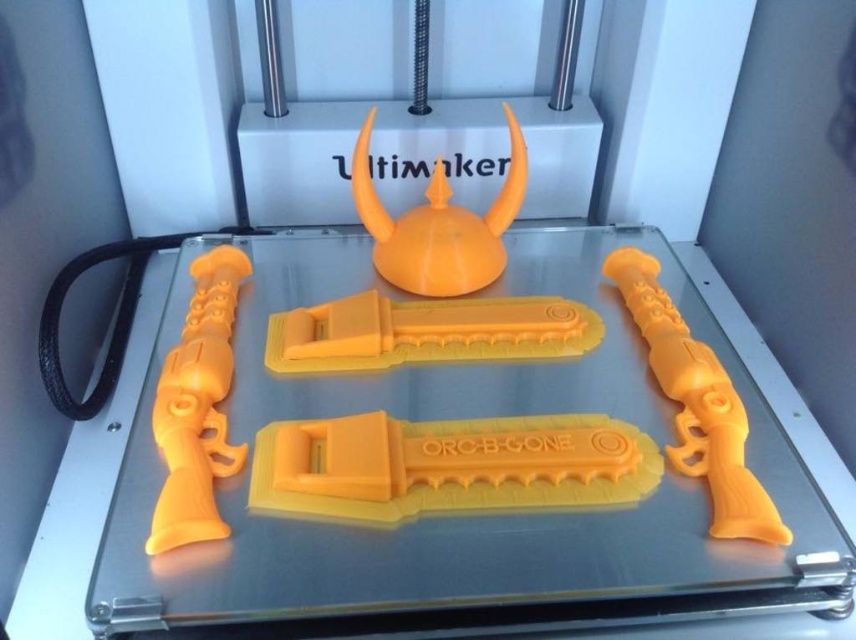
Who is more forward, (758, 630) or (742, 515)?

Positioned in front is point (742, 515).

Which is more to the right, translucent yellow plastic glass table at center or yellow matte plastic revolver at right?

Positioned to the right is yellow matte plastic revolver at right.

You are a GUI agent. You are given a task and a screenshot of the screen. Output one action in this format:
    pyautogui.click(x=<x>, y=<y>)
    Task: Click on the translucent yellow plastic glass table at center
    
    Given the screenshot: What is the action you would take?
    85,490

Which is in front, point (272, 355) or point (762, 531)?

Point (762, 531) is more forward.

Find the location of `yellow matte plastic sword at center`. yellow matte plastic sword at center is located at coordinates (425, 332).

Measure the distance between yellow matte plastic sword at center and camera.

yellow matte plastic sword at center and camera are 92.20 centimeters apart from each other.

Identify the location of yellow matte plastic sword at center. (425, 332).

Does yellow matte/orange plastic knife at center have a smaller size compared to yellow matte plastic sword at center?

Yes, yellow matte/orange plastic knife at center is smaller than yellow matte plastic sword at center.

Consider the image. Who is lower down, yellow matte/orange plastic knife at center or yellow matte plastic sword at center?

yellow matte/orange plastic knife at center is below.

Where is `yellow matte/orange plastic knife at center`? The width and height of the screenshot is (856, 640). yellow matte/orange plastic knife at center is located at coordinates (449, 465).